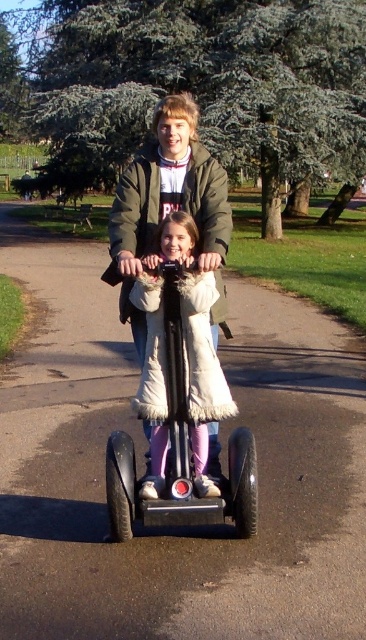
You are a photographer standing at the edge of the park. You want to take a photo of the matte green jacket at center and the metallic silver scooter at center so that both are fully visible in the frame. Considering their heights, which object should you focus on to ensure both are in focus?

The matte green jacket at center is taller than the metallic silver scooter at center, so focusing on the matte green jacket at center will ensure both are in focus since it is the taller object.